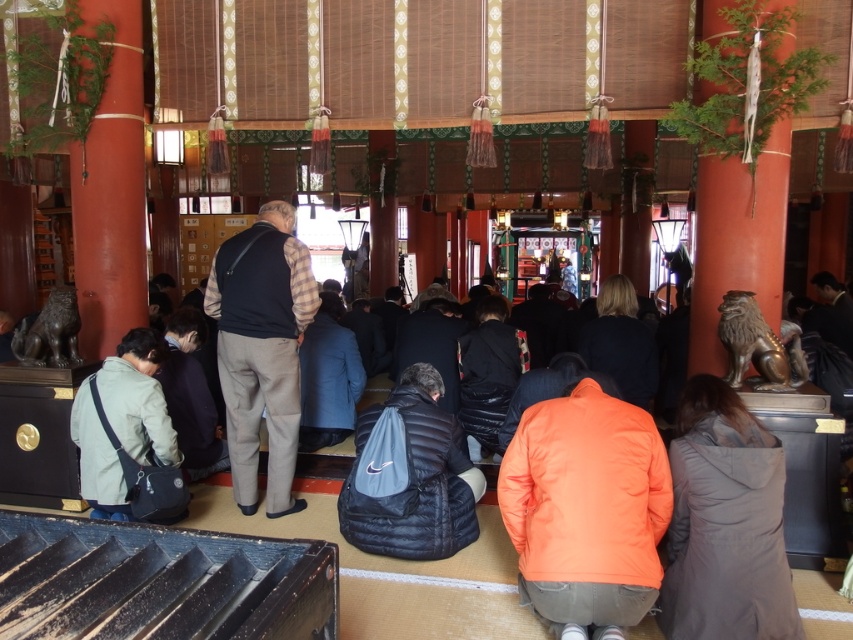
Is light gray fabric jacket at lower left to the left of dark blue jacket at center from the viewer's perspective?

Indeed, light gray fabric jacket at lower left is positioned on the left side of dark blue jacket at center.

This screenshot has height=640, width=853. Find the location of `light gray fabric jacket at lower left`. light gray fabric jacket at lower left is located at coordinates (190, 396).

The height and width of the screenshot is (640, 853). I want to click on light gray fabric jacket at lower left, so click(190, 396).

Which is in front, point (508, 369) or point (634, 326)?

Positioned in front is point (634, 326).

What are the coordinates of `black puffy jacket at center` in the screenshot? It's located at (488, 372).

Who is shorter, black down jacket at center or black puffy jacket at center?

black down jacket at center is shorter.

Does black down jacket at center have a lesser width compared to black puffy jacket at center?

No, black down jacket at center is not thinner than black puffy jacket at center.

Which is in front, point (459, 470) or point (502, 310)?

Point (459, 470)

You are a GUI agent. You are given a task and a screenshot of the screen. Output one action in this format:
    pyautogui.click(x=<x>, y=<y>)
    Task: Click on the black down jacket at center
    This screenshot has width=853, height=640.
    Given the screenshot: What is the action you would take?
    pyautogui.click(x=410, y=476)